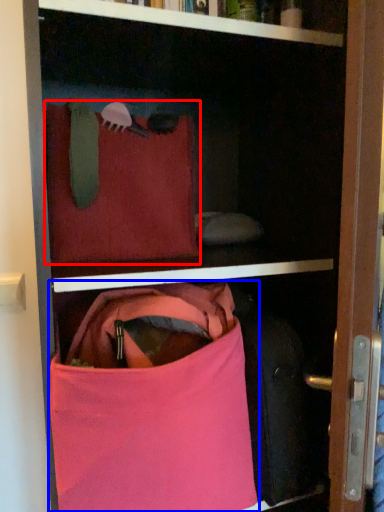
Question: Which of the following is the closest to the observer, pillow (highlighted by a red box) or handbag (highlighted by a blue box)?

Choices:
 (A) pillow
 (B) handbag

Answer: (B)